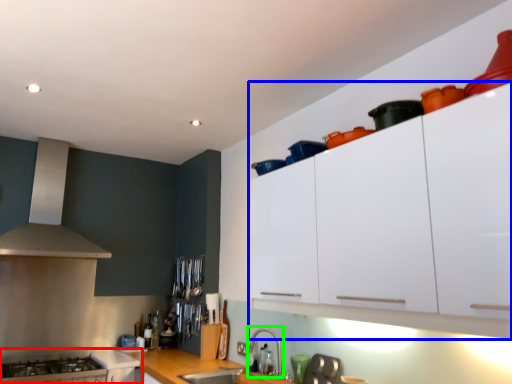
Question: Which object is positioned closest to cabinetry (highlighted by a red box)? Select from cabinetry (highlighted by a blue box) and faucet (highlighted by a green box).

Choices:
 (A) cabinetry
 (B) faucet

Answer: (B)